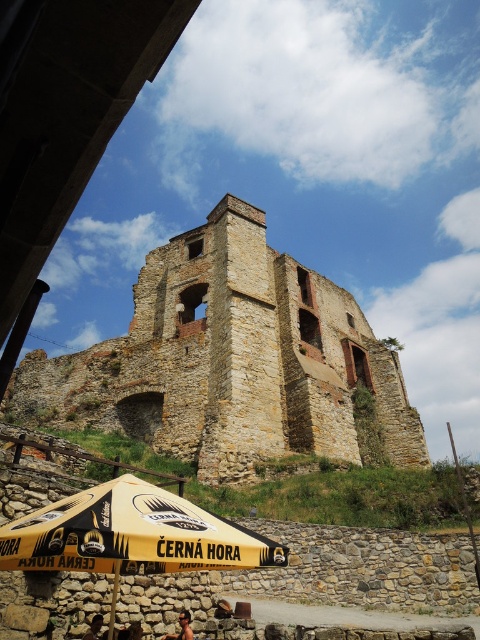
Based on the photo, is stone brick castle at center in front of yellow fabric umbrella at lower center?

No, stone brick castle at center is behind yellow fabric umbrella at lower center.

Is stone brick castle at center below yellow fabric umbrella at lower center?

No, stone brick castle at center is not below yellow fabric umbrella at lower center.

Is point (188, 420) farther from viewer compared to point (19, 525)?

Yes, it is.

Locate an element on the screen. The height and width of the screenshot is (640, 480). stone brick castle at center is located at coordinates (229, 360).

Is yellow fabric umbrella at lower center smaller than brown leather chair at lower center?

No, yellow fabric umbrella at lower center is not smaller than brown leather chair at lower center.

Which is in front, point (75, 506) or point (140, 627)?

Point (75, 506)

Who is more forward, [83,531] or [128,627]?

Point [83,531] is in front.

I want to click on yellow fabric umbrella at lower center, so click(x=131, y=536).

Is yellow fabric umbrella at lower center bigger than dark brown leather jacket at lower left?

Indeed, yellow fabric umbrella at lower center has a larger size compared to dark brown leather jacket at lower left.

Between point (110, 561) and point (97, 627), which one is positioned behind?

Positioned behind is point (97, 627).

Locate an element on the screen. The image size is (480, 640). yellow fabric umbrella at lower center is located at coordinates (131, 536).